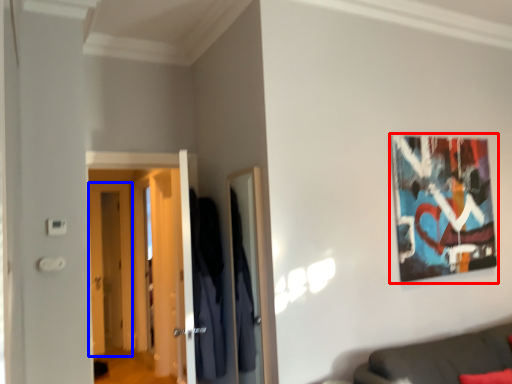
Question: Which object is closer to the camera taking this photo, picture frame (highlighted by a red box) or door (highlighted by a blue box)?

Choices:
 (A) picture frame
 (B) door

Answer: (A)